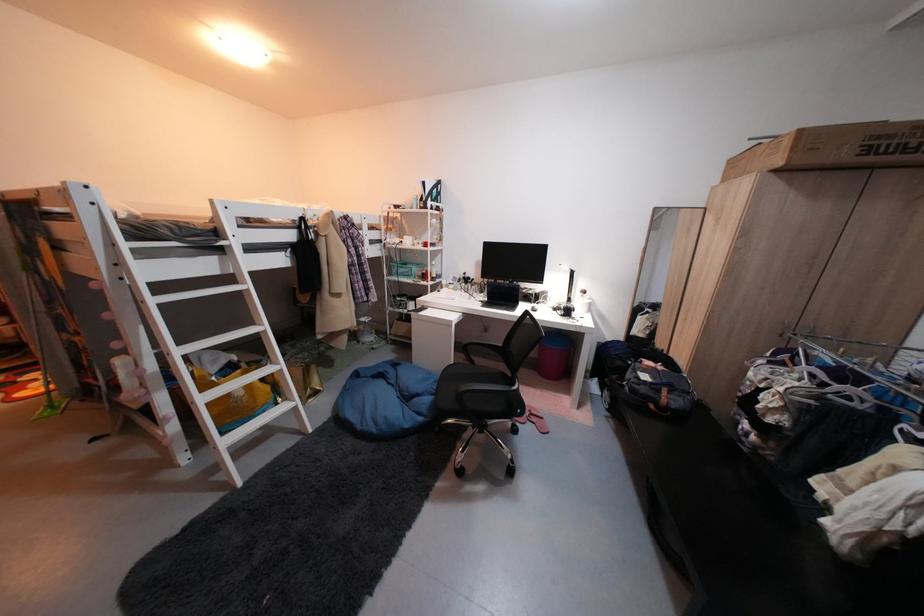
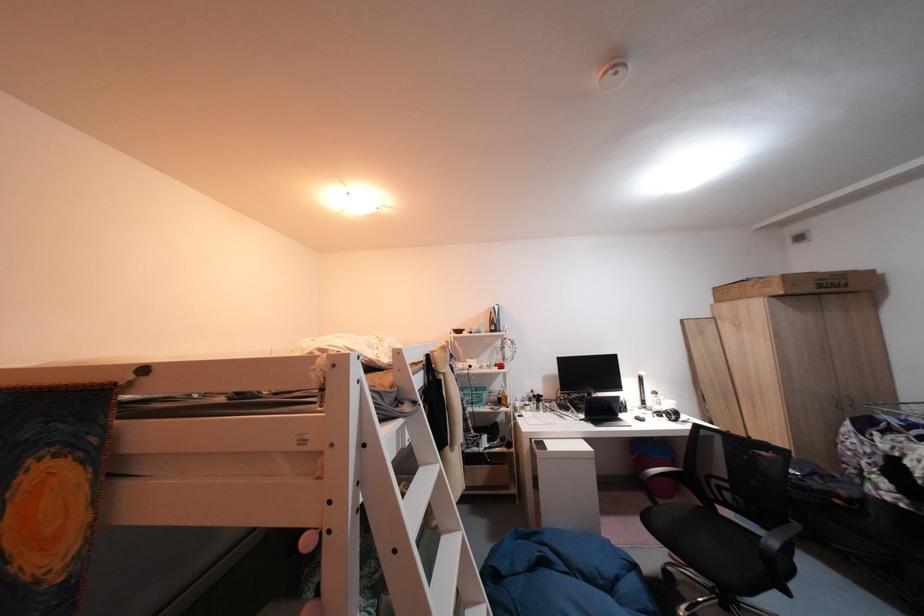
The point at (128, 265) is marked in the first image. Where is the corresponding point in the second image?

(370, 485)